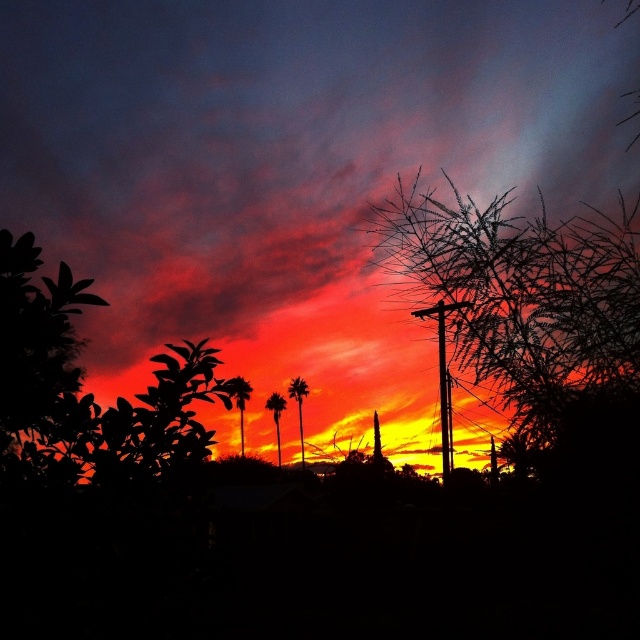
Can you confirm if orange matte cloud at upper center is positioned above bare branches at upper right?

Yes.

Who is more forward, (16,19) or (600,340)?

Point (600,340) is more forward.

Is point (22, 92) less distant than point (515, 276)?

That is False.

Image resolution: width=640 pixels, height=640 pixels. What are the coordinates of `orange matte cloud at upper center` in the screenshot? It's located at (291, 173).

Who is more forward, (557, 266) or (276, 413)?

Point (557, 266)

In the scene shown: Does bare branches at upper right have a smaller size compared to silhouette palm tree at center?

Actually, bare branches at upper right might be larger than silhouette palm tree at center.

Is point (444, 294) positioned after point (276, 428)?

No, (444, 294) is in front of (276, 428).

This screenshot has width=640, height=640. What are the coordinates of `bare branches at upper right` in the screenshot? It's located at (524, 296).

Between silky brown palm tree at center and silhouette palm tree at center, which one has less height?

silhouette palm tree at center

In order to click on silky brown palm tree at center in this screenshot , I will do `click(298, 406)`.

You are a GUI agent. You are given a task and a screenshot of the screen. Output one action in this format:
    pyautogui.click(x=<x>, y=<y>)
    Task: Click on the silky brown palm tree at center
    
    Given the screenshot: What is the action you would take?
    pyautogui.click(x=298, y=406)